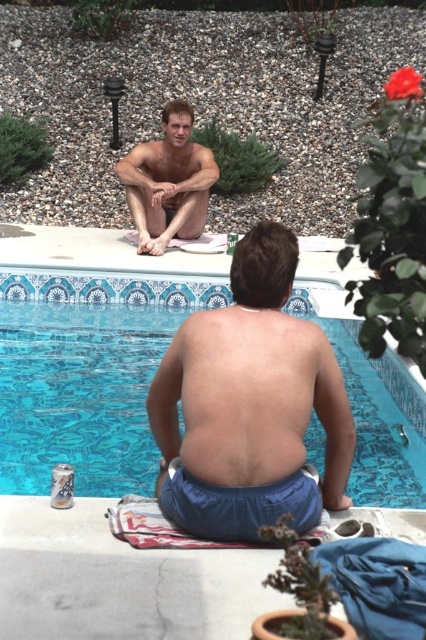
You are standing at the edge of the pool and see the blue fabric shorts at center and the muscular tan skin at back. Which object is positioned more to the right side of the scene?

The blue fabric shorts at center are positioned more to the right side of the scene compared to the muscular tan skin at back.

You are a lifeguard standing at the edge of the pool. You need to reach the smooth skin man at upper center who is in distress. The pool has a depth of 4 feet. Can you safely swim to him from the blue glossy water at center without diving?

The distance between the blue glossy water at center and the smooth skin man at upper center is 3.77 feet. Since the pool is 4 feet deep, you can safely swim to him without needing to dive as the depth is sufficient for swimming.